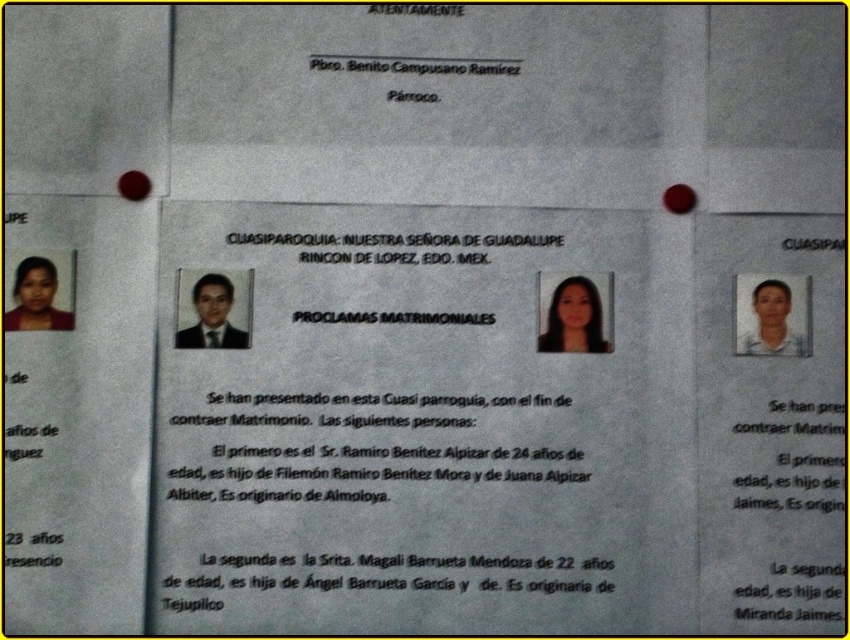
Can you confirm if black paper text at center is taller than matte black suit at center?

Yes, black paper text at center is taller than matte black suit at center.

Is point (783, 499) behind point (221, 280)?

No, (783, 499) is closer to viewer.

Which is behind, point (836, 445) or point (208, 298)?

The point (836, 445) is behind.

Find the location of `black paper text at center`. black paper text at center is located at coordinates (786, 513).

Where is `black paper at center`? This screenshot has height=640, width=850. black paper at center is located at coordinates (391, 244).

This screenshot has height=640, width=850. What do you see at coordinates (391, 244) in the screenshot?
I see `black paper at center` at bounding box center [391, 244].

Is point (403, 241) positioned in front of point (823, 246)?

That is True.

Where is `black paper at center`? The height and width of the screenshot is (640, 850). black paper at center is located at coordinates (391, 244).

Between matte black portrait at left and matte black suit at center, which one has less height?

With less height is matte black portrait at left.

Is point (34, 269) positioned in front of point (190, 340)?

No.

Locate an element on the screen. The width and height of the screenshot is (850, 640). matte black portrait at left is located at coordinates (37, 298).